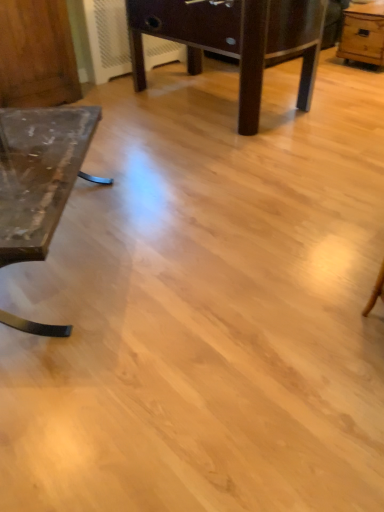
At what (x,y) coordinates should I click in order to perform the action: click on free spot below matte glass table at left, placed as the third table when sorted from right to left (from a real-world perspective). Please return your answer as a coordinate pair (x, y). The width and height of the screenshot is (384, 512). Looking at the image, I should click on (48, 261).